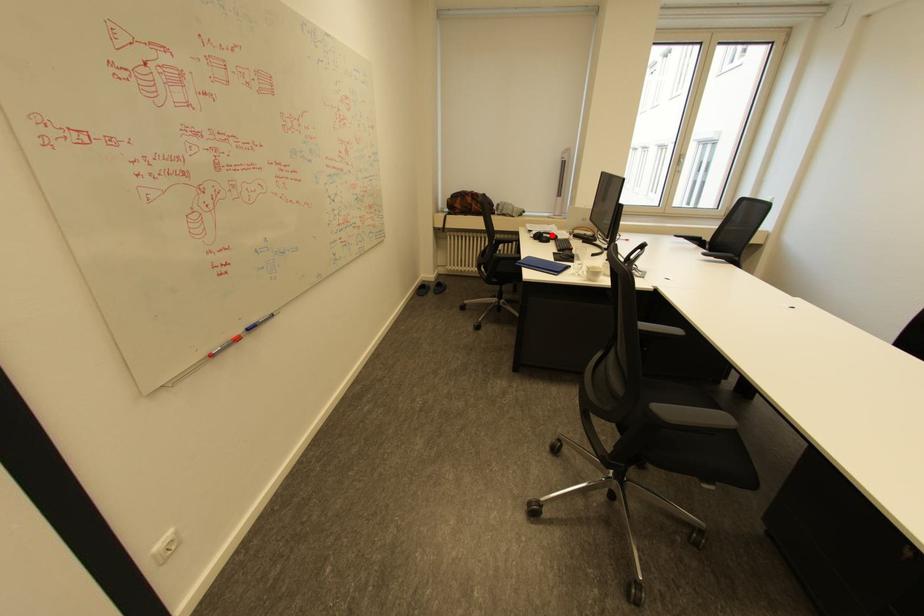
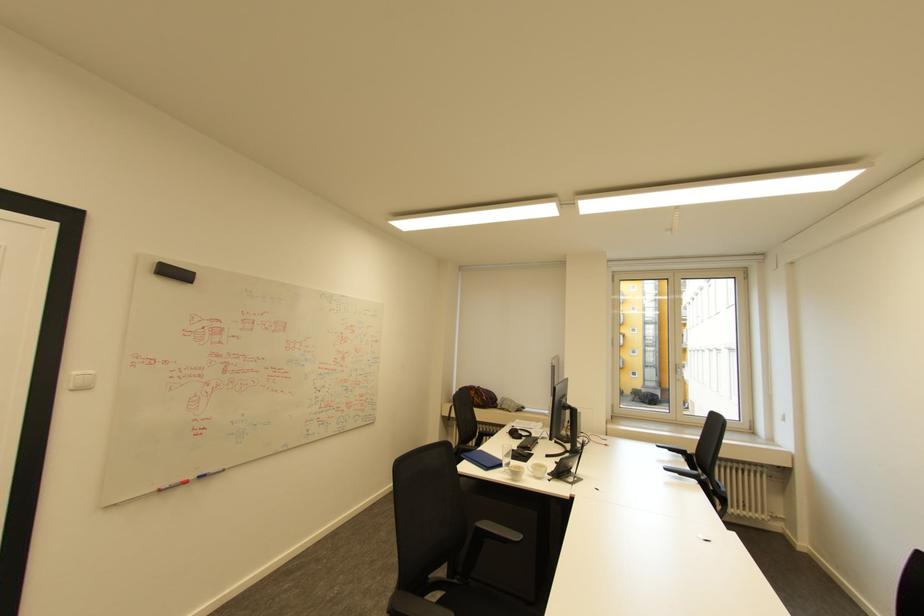
Question: I am providing you with two images of the same scene from different viewpoints. Image1 has a red point marked. In image2, the corresponding 3D location appears at what relative position? Reply with the corresponding letter.

Choices:
 (A) Closer
 (B) Farther

Answer: (B)